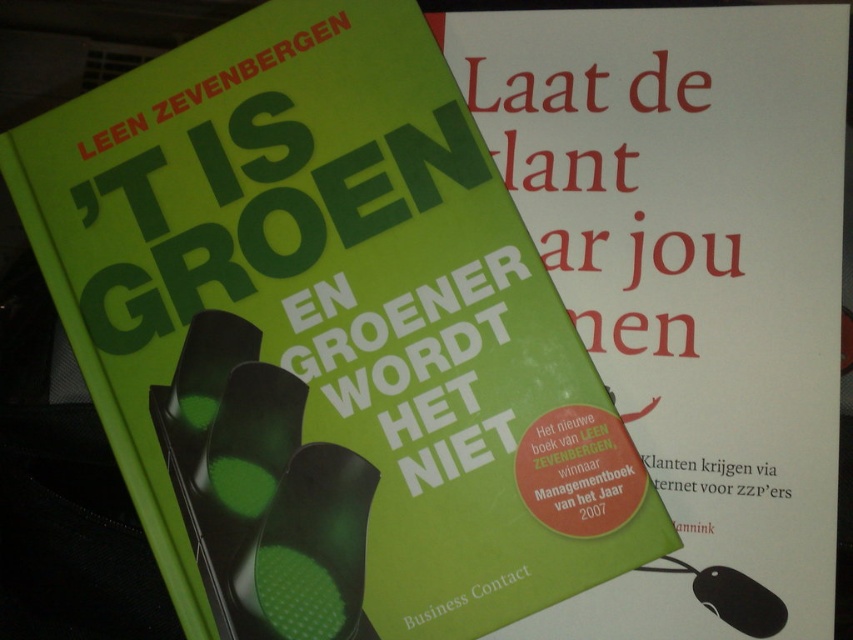
Which of these two, green matte book cover at upper right or black rubber mouse at lower right, stands taller?

Standing taller between the two is green matte book cover at upper right.

Between green matte book cover at upper right and black rubber mouse at lower right, which one is positioned lower?

black rubber mouse at lower right is below.

Looking at this image, measure the distance between point (793,540) and camera.

Point (793,540) and camera are 32.28 inches apart.

The image size is (853, 640). Identify the location of green matte book cover at upper right. tap(688, 275).